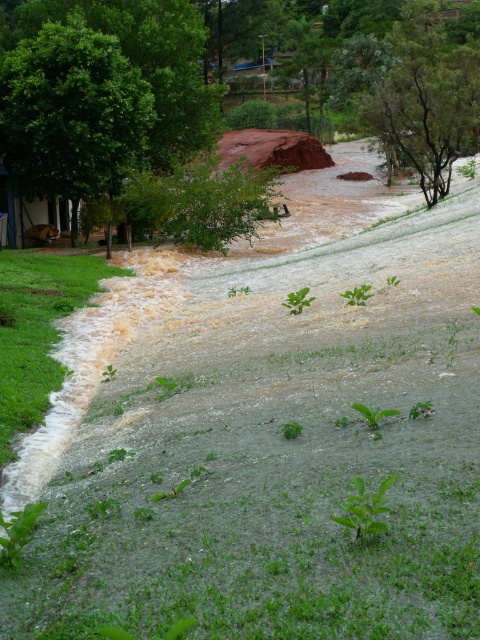
Question: Does green leafy tree at upper left appear over green leafy tree at center?

Choices:
 (A) no
 (B) yes

Answer: (B)

Question: Can you confirm if green leafy tree at upper left is wider than green leafy tree at center?

Choices:
 (A) no
 (B) yes

Answer: (B)

Question: Which point appears farthest from the camera in this image?

Choices:
 (A) (251, 180)
 (B) (119, 150)

Answer: (A)

Question: Can you confirm if green leafy tree at upper left is thinner than green leafy tree at center?

Choices:
 (A) yes
 (B) no

Answer: (B)

Question: Which of the following is the closest to the observer?

Choices:
 (A) green leafy tree at upper left
 (B) green leafy tree at center

Answer: (A)